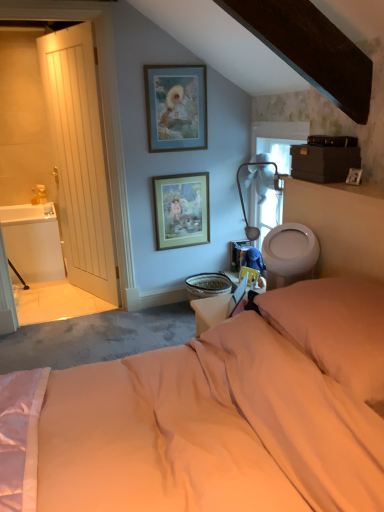
This screenshot has width=384, height=512. What are the coordinates of `free space above white wooden door at left (from a real-world perspective)` in the screenshot? It's located at (64, 25).